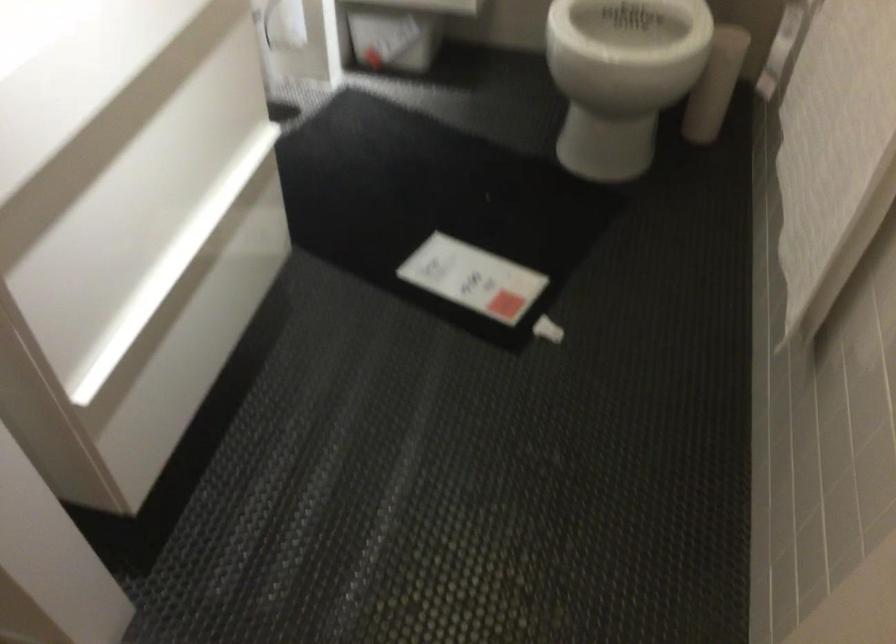
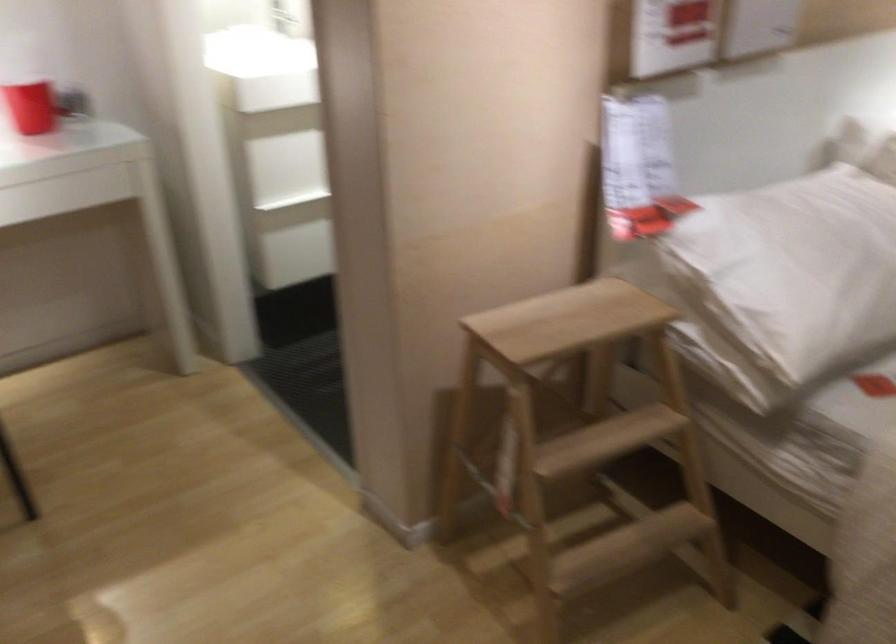
Question: I am providing you with two images of the same scene from different viewpoints. Please identify which objects are invisible in image2.

Choices:
 (A) red cup
 (B) white cylindrical holder
 (C) small wooden bowl
 (D) white pillow

Answer: (B)